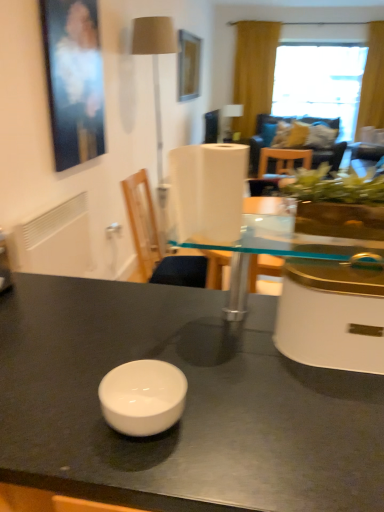
Find the location of a particular element. spots to the right of white glossy bowl at center is located at coordinates (249, 421).